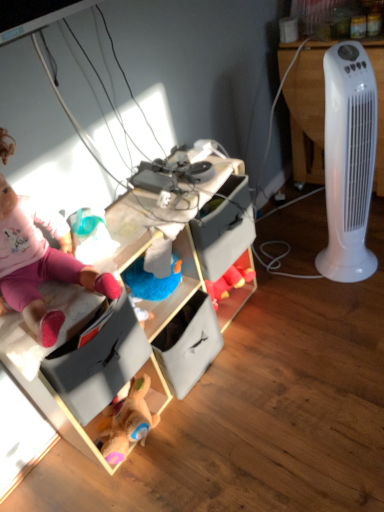
Locate an element on the screen. This screenshot has height=512, width=384. vacant area located to the right-hand side of wooden toy storage at center is located at coordinates (300, 335).